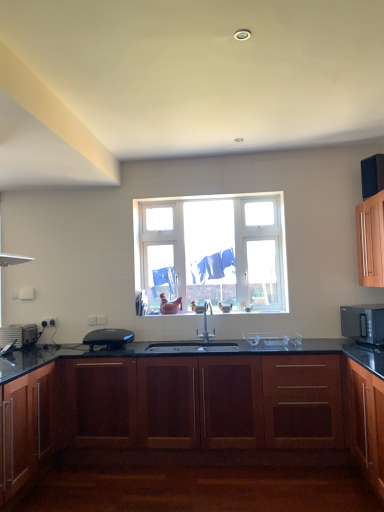
Measure the distance between clear glass window at center and camera.

clear glass window at center is 3.98 meters away from camera.

What do you see at coordinates (363, 323) in the screenshot? The width and height of the screenshot is (384, 512). I see `silver metallic microwave oven at right` at bounding box center [363, 323].

Where is `silver metallic toaster at left, the second appliance positioned from the right`? The image size is (384, 512). silver metallic toaster at left, the second appliance positioned from the right is located at coordinates (18, 335).

From the picture: Measure the distance between point (367, 272) and camera.

3.84 meters.

Where is `clear glass window at center`? Image resolution: width=384 pixels, height=512 pixels. clear glass window at center is located at coordinates (212, 252).

Is mahogany wood cabinet at center, which appears as the 1th cabinetry when viewed from the left, located outside mahogany wood cabinet at lower right, positioned as the second cabinetry in left-to-right order?

Yes, mahogany wood cabinet at center, which appears as the 1th cabinetry when viewed from the left, is located beyond the bounds of mahogany wood cabinet at lower right, positioned as the second cabinetry in left-to-right order.

From the image's perspective, which is above, mahogany wood cabinet at center, which ranks as the 3th cabinetry in right-to-left order, or mahogany wood cabinet at lower right, the 2th cabinetry viewed from the right?

mahogany wood cabinet at lower right, the 2th cabinetry viewed from the right, from the image's perspective.

Find the location of `cabinetry that appears on the left of silver metallic faucet at center`. cabinetry that appears on the left of silver metallic faucet at center is located at coordinates (192, 429).

Does mahogany wood cabinet at center, which ranks as the 3th cabinetry in right-to-left order, touch silver metallic faucet at center?

No, mahogany wood cabinet at center, which ranks as the 3th cabinetry in right-to-left order, is not beside silver metallic faucet at center.

Does point (8, 484) appear closer or farther from the camera than point (200, 334)?

Clearly, point (8, 484) is closer to the camera than point (200, 334).

Could you tell me if mahogany wood cabinet at center, which appears as the 1th cabinetry when viewed from the left, is facing silver metallic faucet at center?

No, mahogany wood cabinet at center, which appears as the 1th cabinetry when viewed from the left, is not aimed at silver metallic faucet at center.

How many degrees apart are the facing directions of cabinet at right, the third cabinetry from the left, and black plastic toaster at center, marked as the second appliance in a left-to-right arrangement?

There is a 87.8-degree angle between the facing directions of cabinet at right, the third cabinetry from the left, and black plastic toaster at center, marked as the second appliance in a left-to-right arrangement.

Can you confirm if cabinet at right, acting as the first cabinetry starting from the right, is positioned to the left of black plastic toaster at center, which is the 1th appliance in right-to-left order?

No.

Is cabinet at right, the third cabinetry from the left, not close to black plastic toaster at center, which is the 1th appliance in right-to-left order?

Indeed, cabinet at right, the third cabinetry from the left, is not near black plastic toaster at center, which is the 1th appliance in right-to-left order.

From their relative heights in the image, would you say cabinet at right, acting as the first cabinetry starting from the right, is taller or shorter than black plastic toaster at center, which is the 1th appliance in right-to-left order?

cabinet at right, acting as the first cabinetry starting from the right, is taller than black plastic toaster at center, which is the 1th appliance in right-to-left order.

From the picture: Is silver metallic faucet at center facing away from black plastic toaster at center, marked as the second appliance in a left-to-right arrangement?

No, black plastic toaster at center, marked as the second appliance in a left-to-right arrangement, is not at the back of silver metallic faucet at center.

Do you think silver metallic faucet at center is within black plastic toaster at center, marked as the second appliance in a left-to-right arrangement, or outside of it?

silver metallic faucet at center is not enclosed by black plastic toaster at center, marked as the second appliance in a left-to-right arrangement.

Which object is positioned more to the left, silver metallic faucet at center or black plastic toaster at center, marked as the second appliance in a left-to-right arrangement?

black plastic toaster at center, marked as the second appliance in a left-to-right arrangement.

Does clear glass window at center touch mahogany wood cabinet at center, which appears as the 1th cabinetry when viewed from the left?

No.

Based on the photo, how distant is clear glass window at center from mahogany wood cabinet at center, which ranks as the 3th cabinetry in right-to-left order?

clear glass window at center and mahogany wood cabinet at center, which ranks as the 3th cabinetry in right-to-left order, are 1.24 meters apart from each other.

Considering the sizes of objects clear glass window at center and mahogany wood cabinet at center, which appears as the 1th cabinetry when viewed from the left, in the image provided, who is shorter, clear glass window at center or mahogany wood cabinet at center, which appears as the 1th cabinetry when viewed from the left,?

With less height is mahogany wood cabinet at center, which appears as the 1th cabinetry when viewed from the left.

Is clear glass window at center aimed at silver metallic microwave oven at right?

No.

Is clear glass window at center inside the boundaries of silver metallic microwave oven at right, or outside?

The correct answer is: outside.

Is clear glass window at center behind silver metallic microwave oven at right?

Yes, clear glass window at center is further from the camera.

Is clear glass window at center placed right next to silver metallic microwave oven at right?

No, clear glass window at center is not in contact with silver metallic microwave oven at right.

Between silver metallic toaster at left, the second appliance positioned from the right, and silver metallic faucet at center, which one appears on the right side from the viewer's perspective?

silver metallic faucet at center is more to the right.

Where is `the 1st appliance directly beneath the silver metallic faucet at center (from a real-world perspective)`? This screenshot has width=384, height=512. the 1st appliance directly beneath the silver metallic faucet at center (from a real-world perspective) is located at coordinates (18, 335).

In the scene shown: Does silver metallic toaster at left, the second appliance positioned from the right, have a greater height compared to silver metallic faucet at center?

Incorrect, the height of silver metallic toaster at left, the second appliance positioned from the right, is not larger of that of silver metallic faucet at center.

Looking at this image, can you confirm if silver metallic toaster at left, the second appliance positioned from the right, is smaller than silver metallic faucet at center?

Correct, silver metallic toaster at left, the second appliance positioned from the right, occupies less space than silver metallic faucet at center.

The image size is (384, 512). Find the location of `the 1st cabinetry behind when counting from the mahogany wood cabinet at center, which appears as the 1th cabinetry when viewed from the left`. the 1st cabinetry behind when counting from the mahogany wood cabinet at center, which appears as the 1th cabinetry when viewed from the left is located at coordinates (365, 420).

Locate an element on the screen. The height and width of the screenshot is (512, 384). cabinetry on the left of silver metallic faucet at center is located at coordinates (192, 429).

From the picture: From the image, which object appears to be farther from silver metallic faucet at center, silver metallic toaster at left, which appears as the 1th appliance when viewed from the left, or black plastic toaster at center, marked as the second appliance in a left-to-right arrangement?

silver metallic toaster at left, which appears as the 1th appliance when viewed from the left, lies further to silver metallic faucet at center than the other object.

Considering their positions, is black plastic toaster at center, marked as the second appliance in a left-to-right arrangement, positioned closer to cabinet at right, acting as the first cabinetry starting from the right, than mahogany wood cabinet at lower right, the 2th cabinetry viewed from the right?

mahogany wood cabinet at lower right, the 2th cabinetry viewed from the right.

When comparing their distances from clear glass window at center, does cabinet at right, acting as the first cabinetry starting from the right, or silver metallic microwave oven at right seem further?

silver metallic microwave oven at right is further to clear glass window at center.

Which object lies nearer to the anchor point silver metallic microwave oven at right, cabinet at right, acting as the first cabinetry starting from the right, or mahogany wood cabinet at center, which appears as the 1th cabinetry when viewed from the left?

cabinet at right, acting as the first cabinetry starting from the right, lies closer to silver metallic microwave oven at right than the other object.

Looking at the image, which one is located further to mahogany wood cabinet at lower right, positioned as the second cabinetry in left-to-right order, black plastic toaster at center, marked as the second appliance in a left-to-right arrangement, or cabinet at right, the third cabinetry from the left?

black plastic toaster at center, marked as the second appliance in a left-to-right arrangement.

In the scene shown: Considering their positions, is cabinet at right, acting as the first cabinetry starting from the right, positioned further to silver metallic microwave oven at right than silver metallic faucet at center?

Based on the image, silver metallic faucet at center appears to be further to silver metallic microwave oven at right.

From the image, which object appears to be farther from cabinet at right, the third cabinetry from the left, silver metallic microwave oven at right or mahogany wood cabinet at lower right, the 2th cabinetry viewed from the right?

Among the two, mahogany wood cabinet at lower right, the 2th cabinetry viewed from the right, is located further to cabinet at right, the third cabinetry from the left.

Estimate the real-world distances between objects in this image. Which object is closer to silver metallic toaster at left, the second appliance positioned from the right, black plastic toaster at center, marked as the second appliance in a left-to-right arrangement, or mahogany wood cabinet at center, which ranks as the 3th cabinetry in right-to-left order?

black plastic toaster at center, marked as the second appliance in a left-to-right arrangement, is closer to silver metallic toaster at left, the second appliance positioned from the right.

I want to click on tap between black plastic toaster at center, which is the 1th appliance in right-to-left order, and cabinet at right, the third cabinetry from the left, in the horizontal direction, so click(x=206, y=322).

Identify the location of window located between silver metallic faucet at center and cabinet at right, acting as the first cabinetry starting from the right, in the left-right direction. The height and width of the screenshot is (512, 384). (212, 252).

This screenshot has width=384, height=512. Find the location of `appliance situated between silver metallic toaster at left, the second appliance positioned from the right, and silver metallic faucet at center from left to right`. appliance situated between silver metallic toaster at left, the second appliance positioned from the right, and silver metallic faucet at center from left to right is located at coordinates (109, 338).

The height and width of the screenshot is (512, 384). Identify the location of tap located between silver metallic toaster at left, the second appliance positioned from the right, and mahogany wood cabinet at lower right, positioned as the second cabinetry in left-to-right order, in the left-right direction. [x=206, y=322].